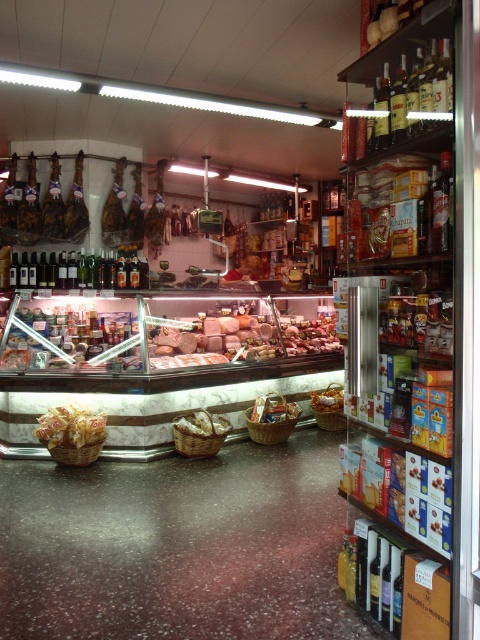
You are a customer in the grocery store and want to grab both the yellow matte bread at center and the golden brown bread at center. Can you reach both items without moving your position?

The yellow matte bread at center and golden brown bread at center are 7.89 feet apart, so you can reach both items without moving your position as they are within a comfortable distance.